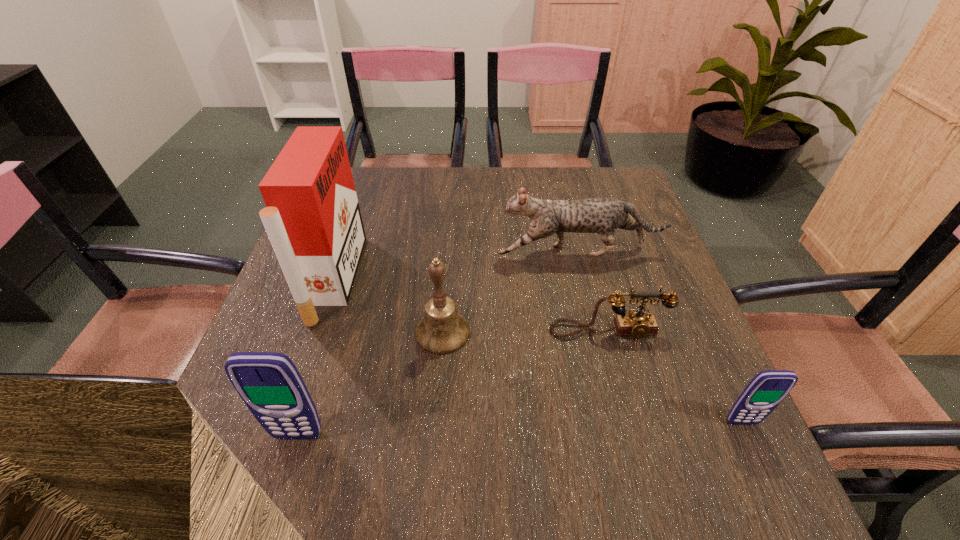
At what (x,y) coordinates should I click in order to perform the action: click on empty location between the telephone and the shorter cellular telephone. Please return your answer as a coordinate pair (x, y). Looking at the image, I should click on pos(675,377).

Find the location of `free space between the tallest object and the farther cellular telephone`. free space between the tallest object and the farther cellular telephone is located at coordinates (539, 350).

The image size is (960, 540). I want to click on free point between the telephone and the taller cellular telephone, so click(453, 383).

At what (x,y) coordinates should I click in order to perform the action: click on empty space that is in between the tallest object and the bell. Please return your answer as a coordinate pair (x, y). Looking at the image, I should click on (389, 306).

Where is `free space between the telephone and the second shortest object`? The width and height of the screenshot is (960, 540). free space between the telephone and the second shortest object is located at coordinates (675, 377).

Identify the location of free space that is in between the third object from left to right and the nearest object. The height and width of the screenshot is (540, 960). (371, 384).

At what (x,y) coordinates should I click in order to perform the action: click on object that is the third closest to the cigarette case. Please return your answer as a coordinate pair (x, y). This screenshot has width=960, height=540. Looking at the image, I should click on (602, 216).

I want to click on object that can be found as the fifth closest to the telephone, so click(269, 383).

This screenshot has height=540, width=960. Identify the location of vacant space that satisfies the following two spatial constraints: 1. on the front-facing side of the cigarette case; 2. on the back side of the bell. (317, 332).